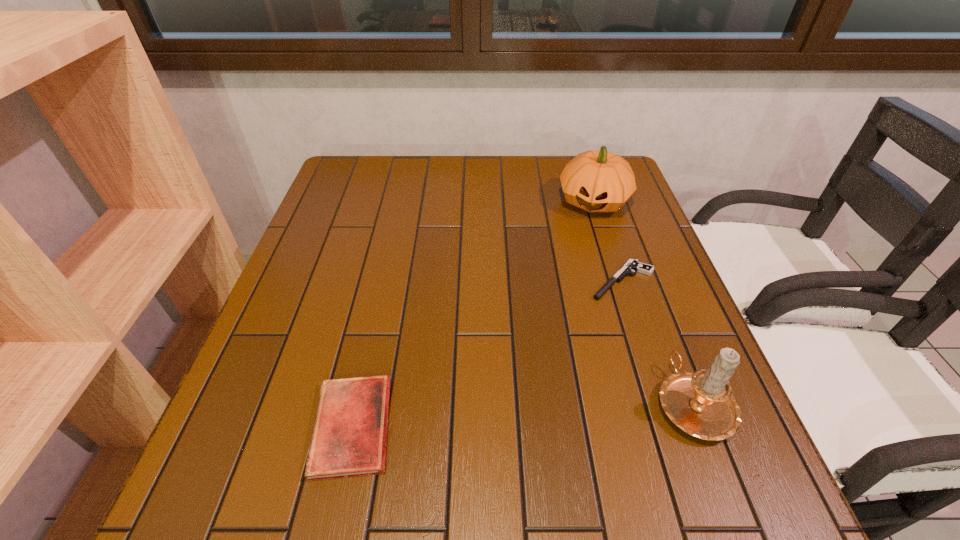
What are the coordinates of `blank region between the candle and the diary` in the screenshot? It's located at (523, 415).

Identify the location of unoccupied area between the leftmost object and the candle. The width and height of the screenshot is (960, 540). [x=523, y=415].

The height and width of the screenshot is (540, 960). Find the location of `vacant space that is in between the gourd and the candle`. vacant space that is in between the gourd and the candle is located at coordinates (643, 302).

You are a GUI agent. You are given a task and a screenshot of the screen. Output one action in this format:
    pyautogui.click(x=<x>, y=<y>)
    Task: Click on the empty location between the candle and the pistol
    The image size is (960, 540).
    Given the screenshot: What is the action you would take?
    pyautogui.click(x=658, y=342)

Locate an element on the screen. vacant area that lies between the third tallest object and the farthest object is located at coordinates (473, 314).

Image resolution: width=960 pixels, height=540 pixels. I want to click on free space between the second farthest object and the candle, so click(x=658, y=342).

Where is `free space between the candle and the gourd`? This screenshot has width=960, height=540. free space between the candle and the gourd is located at coordinates (643, 302).

Where is `vacant space that is in between the shortest object and the farthest object`? The height and width of the screenshot is (540, 960). vacant space that is in between the shortest object and the farthest object is located at coordinates (608, 241).

I want to click on vacant area that lies between the farthest object and the third tallest object, so click(473, 314).

Locate an element on the screen. The width and height of the screenshot is (960, 540). vacant space that's between the gourd and the candle is located at coordinates (643, 302).